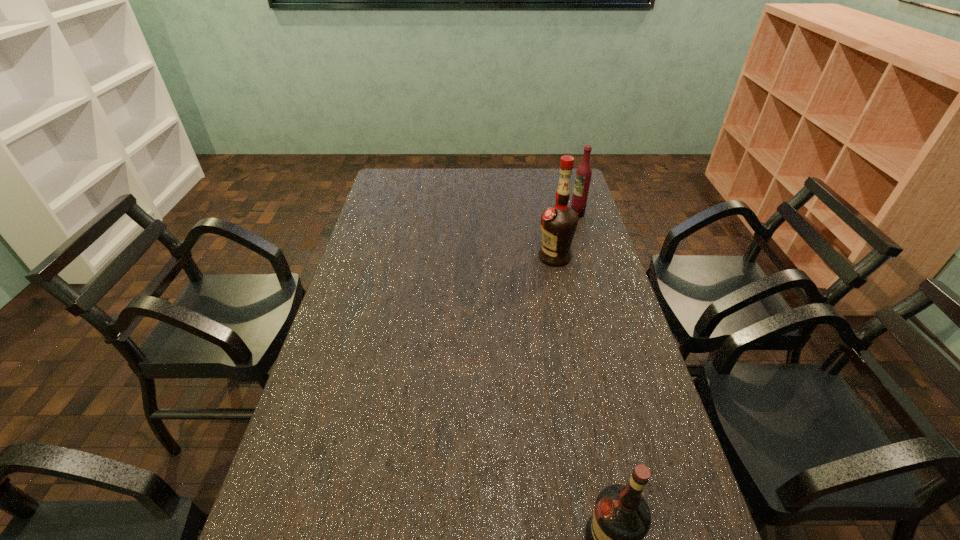
Where is `the second farthest object`? the second farthest object is located at coordinates (559, 222).

Image resolution: width=960 pixels, height=540 pixels. Identify the location of the tallest object. (559, 222).

Image resolution: width=960 pixels, height=540 pixels. Find the location of `the rightmost liquor`. the rightmost liquor is located at coordinates (583, 174).

The image size is (960, 540). I want to click on the farthest object, so click(583, 174).

Identify the location of vacant space located on the front and back of the second nearest liquor. (523, 256).

In order to click on free space located on the front and back of the second nearest liquor in this screenshot , I will do `click(442, 256)`.

Where is `free space located on the front and back of the second nearest liquor`? Image resolution: width=960 pixels, height=540 pixels. free space located on the front and back of the second nearest liquor is located at coordinates (471, 256).

Where is `free space located 0.230m on the label of the rightmost object`? The image size is (960, 540). free space located 0.230m on the label of the rightmost object is located at coordinates (515, 214).

Identify the location of vacant space situated on the label of the rightmost object. This screenshot has height=540, width=960. (548, 214).

Identify the location of vacant point located 0.380m on the label of the rightmost object. This screenshot has height=540, width=960. (478, 214).